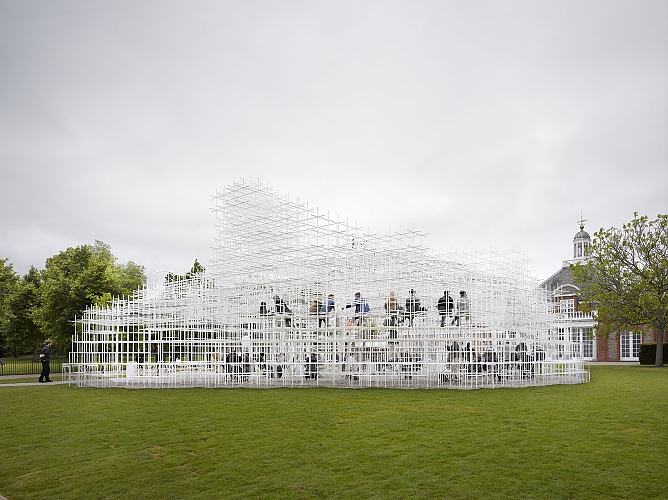
Where is `window`? window is located at coordinates (566, 306).